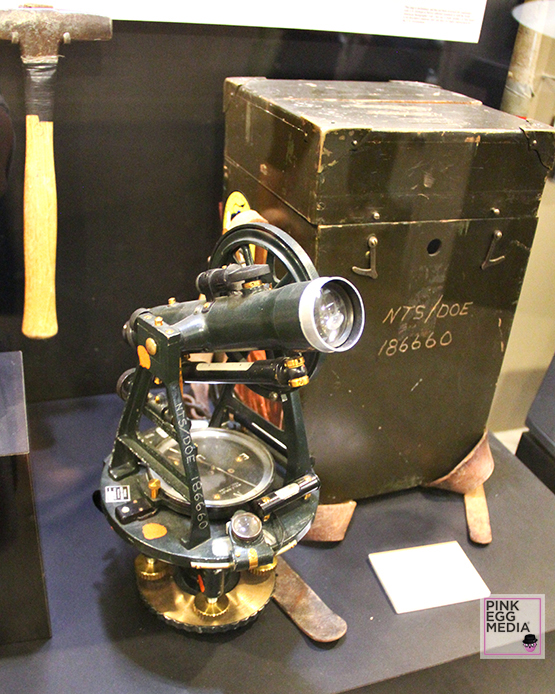
Image resolution: width=555 pixels, height=694 pixels. In order to click on desk in this screenshot , I will do `click(309, 661)`.